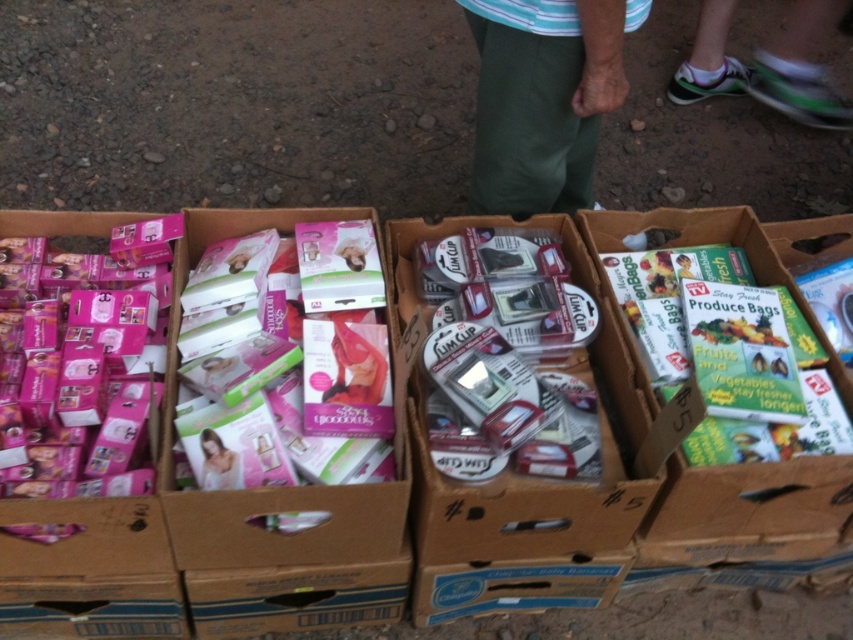
Identify the location of green matte produce bags at lower right. (747, 522).

Is green matte produce bags at lower right above pink matte baby carrier at center?

Yes, green matte produce bags at lower right is above pink matte baby carrier at center.

Locate an element on the screen. The image size is (853, 640). green matte produce bags at lower right is located at coordinates (747, 522).

What do you see at coordinates (767, 65) in the screenshot? Image resolution: width=853 pixels, height=640 pixels. I see `white mesh shoe at upper right` at bounding box center [767, 65].

Which is above, white mesh shoe at upper right or pink matte baby carrier at center?

white mesh shoe at upper right is higher up.

Which is behind, point (695, 60) or point (216, 477)?

The point (695, 60) is behind.

Find the location of `white mesh shoe at upper right`. white mesh shoe at upper right is located at coordinates (767, 65).

Can you confirm if green matte produce bags at lower right is positioned to the left of green cotton pants at center?

No, green matte produce bags at lower right is not to the left of green cotton pants at center.

Does green matte produce bags at lower right have a lesser height compared to green cotton pants at center?

In fact, green matte produce bags at lower right may be taller than green cotton pants at center.

Does point (718, 220) lie in front of point (561, 112)?

No, (718, 220) is further to viewer.

Where is `green matte produce bags at lower right`? This screenshot has width=853, height=640. green matte produce bags at lower right is located at coordinates (747, 522).